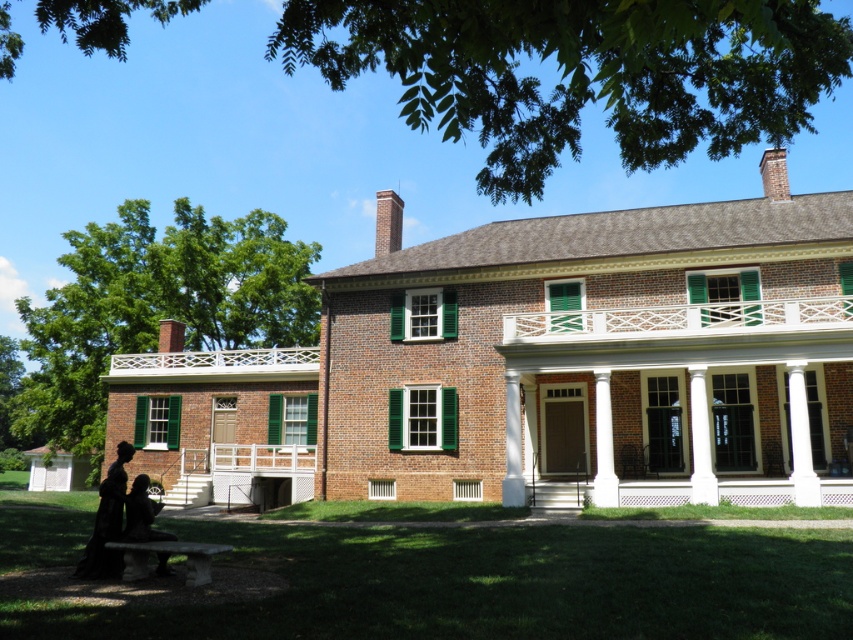
Which is behind, point (474, 396) or point (119, 500)?

Point (474, 396)

Does brick house at center have a smaller size compared to black velvet dress at lower left?

Actually, brick house at center might be larger than black velvet dress at lower left.

Who is more distant from viewer, (254, 442) or (109, 506)?

Point (254, 442)

Find the location of a particular element. Image resolution: width=853 pixels, height=640 pixels. brick house at center is located at coordinates (532, 362).

Is stone bench at lower left in front of dark brown fur at lower left?

Yes, it is.

Who is more distant from viewer, (171, 544) or (132, 540)?

The point (171, 544) is more distant.

This screenshot has width=853, height=640. I want to click on stone bench at lower left, so click(166, 557).

Is brick house at center shorter than dark brown fur at lower left?

Incorrect, brick house at center's height does not fall short of dark brown fur at lower left's.

Who is lower down, brick house at center or dark brown fur at lower left?

dark brown fur at lower left is lower down.

Identify the location of brick house at center. This screenshot has height=640, width=853. (532, 362).

The image size is (853, 640). What are the coordinates of `brick house at center` in the screenshot? It's located at (532, 362).